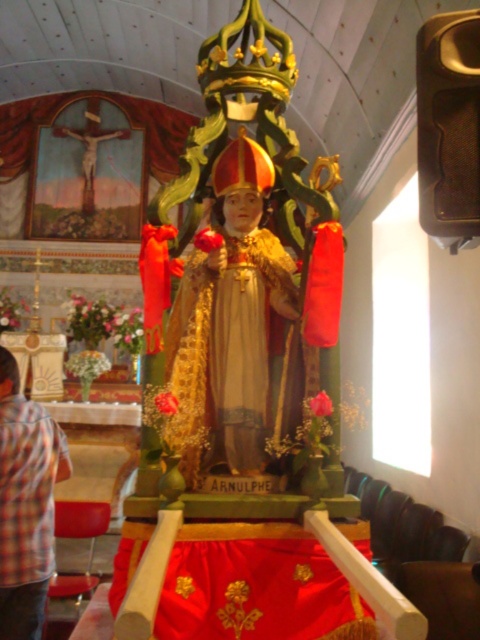
You are an interior designer assessing the space in the church. You need to determine if the plaid shirt at lower left can be placed on the gold textured statue at center without overlapping. Can it fit based on their widths?

The gold textured statue at center is wider than the plaid shirt at lower left. Since the statue is wider, the plaid shirt can be placed on it without overlapping as long as the shirt is positioned within the statue base.

You are standing in the church and want to take a photo of the gold textured statue at center. If you are positioned at point 0.5, 0.5, which direction should you move to get a better view?

Since the gold textured statue at center is located at point (230, 321), you are very close to the statue. To get a better view, you might want to move slightly upwards or downwards to adjust your angle, as the statue is almost directly in front of you.